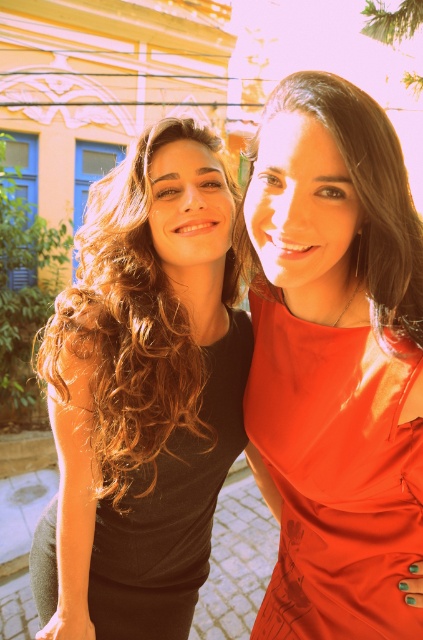
Is satin orange dress at right smaller than matte black dress at left?

Correct, satin orange dress at right occupies less space than matte black dress at left.

Who is positioned more to the left, satin orange dress at right or matte black dress at left?

matte black dress at left

Describe the element at coordinates (335, 474) in the screenshot. I see `satin orange dress at right` at that location.

Identify the location of satin orange dress at right. Image resolution: width=423 pixels, height=640 pixels. (335, 474).

Is satin orange dress at right bigger than matte red dress at center?

Yes.

Is satin orange dress at right positioned in front of matte red dress at center?

That is False.

The width and height of the screenshot is (423, 640). Find the location of `satin orange dress at right`. satin orange dress at right is located at coordinates (335, 474).

Who is shorter, satin orange dress at right or black matte dress at left?

With less height is black matte dress at left.

Who is more distant from viewer, (376, 346) or (99, 515)?

Positioned behind is point (99, 515).

You are a GUI agent. You are given a task and a screenshot of the screen. Output one action in this format:
    pyautogui.click(x=<x>, y=<y>)
    Task: Click on the satin orange dress at right
    This screenshot has height=640, width=423.
    Given the screenshot: What is the action you would take?
    pyautogui.click(x=335, y=474)